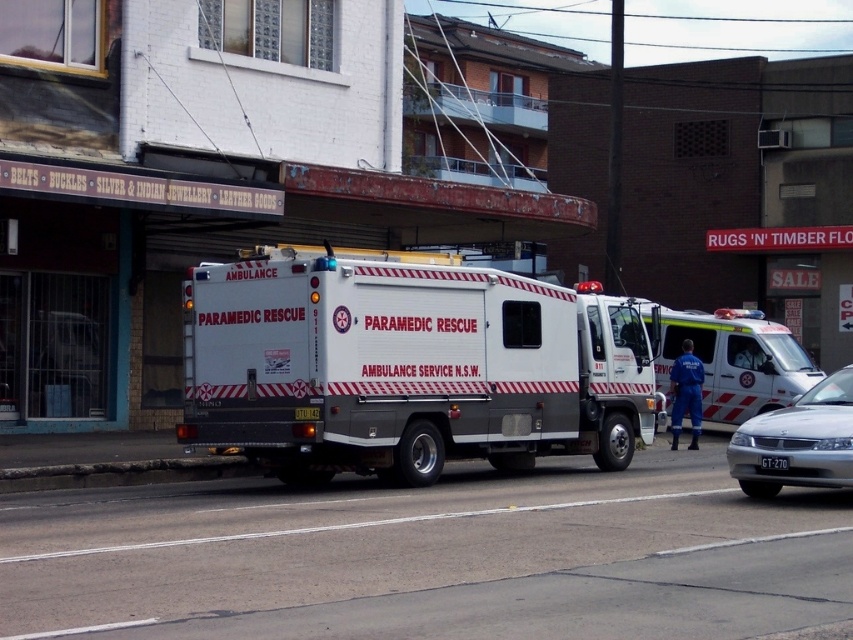
Does white matte ambulance at center come in front of silver metallic sedan at center?

No, white matte ambulance at center is behind silver metallic sedan at center.

Measure the distance between white matte ambulance at center and camera.

white matte ambulance at center is 26.29 meters from camera.

Is point (721, 323) positioned in front of point (831, 397)?

No, it is not.

At what (x,y) coordinates should I click in order to perform the action: click on white matte ambulance at center. Please return your answer as a coordinate pair (x, y). Looking at the image, I should click on coord(734,360).

Which is behind, point (323, 445) or point (846, 474)?

Point (323, 445)

Describe the element at coordinates (405, 365) in the screenshot. I see `white matte paramedic rescue vehicle at center` at that location.

This screenshot has height=640, width=853. In order to click on white matte paramedic rescue vehicle at center in this screenshot , I will do `click(405, 365)`.

Is white matte paramedic rescue vehicle at center below white matte ambulance at center?

Actually, white matte paramedic rescue vehicle at center is above white matte ambulance at center.

Which is behind, point (265, 257) or point (704, 390)?

The point (704, 390) is more distant.

Is point (416, 304) positioned behind point (714, 348)?

No, (416, 304) is in front of (714, 348).

The image size is (853, 640). In order to click on white matte paramedic rescue vehicle at center in this screenshot , I will do `click(405, 365)`.